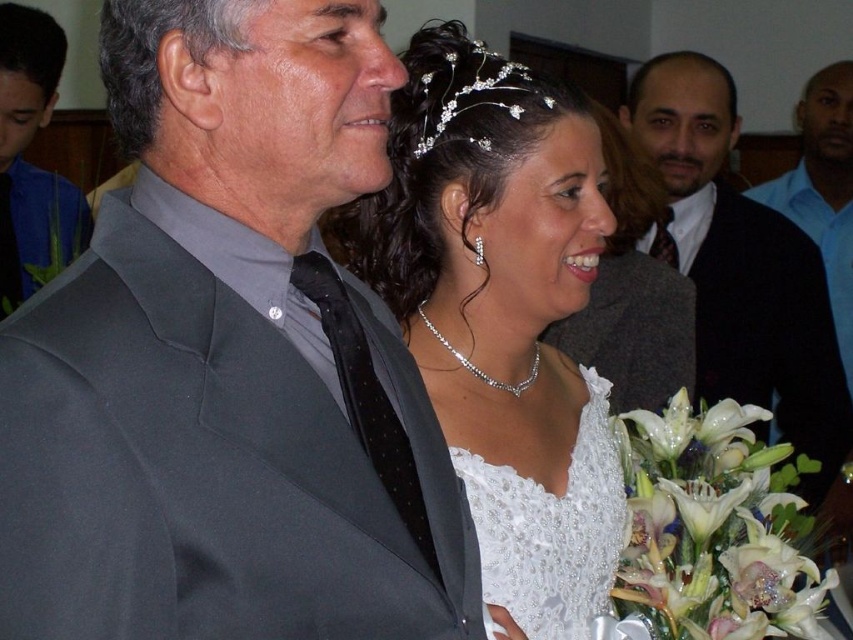
Does point (444, 72) lie behind point (9, 195)?

That is False.

Can you confirm if white satin dress at center is positioned to the right of matte gray suit at left?

Indeed, white satin dress at center is positioned on the right side of matte gray suit at left.

Between point (527, 518) and point (82, 209), which one is positioned in front?

Point (527, 518) is in front.

Where is `white satin dress at center`? The height and width of the screenshot is (640, 853). white satin dress at center is located at coordinates (502, 314).

Who is shorter, smooth skin forehead at upper center or smooth skin face at upper left?

smooth skin forehead at upper center is shorter.

Is smooth skin forehead at upper center thinner than smooth skin face at upper left?

No, smooth skin forehead at upper center is not thinner than smooth skin face at upper left.

Who is more distant from viewer, [639,77] or [32,134]?

Point [32,134]

The width and height of the screenshot is (853, 640). I want to click on smooth skin forehead at upper center, so click(x=682, y=81).

Does blue shirt at upper right appear under smooth skin forehead at upper center?

Yes.

Find the location of `blue shirt at upper right`. blue shirt at upper right is located at coordinates (822, 189).